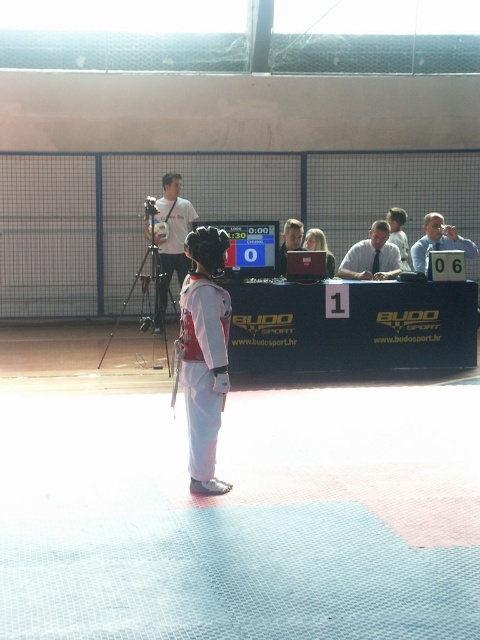
Who is positioned more to the left, light blue shirt at right or smooth brown hair at center?

smooth brown hair at center is more to the left.

Between light blue shirt at right and smooth brown hair at center, which one has more height?

light blue shirt at right

Which is behind, point (433, 248) or point (324, 243)?

Point (433, 248)

Locate an element on the screen. The height and width of the screenshot is (640, 480). light blue shirt at right is located at coordinates pos(439,241).

Is white matte karate robe at center further to camera compared to white shirt at center?

No, it is in front of white shirt at center.

Between point (204, 435) and point (400, 269), which one is positioned behind?

Positioned behind is point (400, 269).

Is point (212, 392) positioned behind point (363, 273)?

No, (212, 392) is closer to viewer.

Identify the location of white matte karate robe at center. (203, 365).

Does white matte karate robe at center have a smaller size compared to light blue shirt at right?

Yes.

Is white matte karate robe at center above light blue shirt at right?

Incorrect, white matte karate robe at center is not positioned above light blue shirt at right.

Who is more forward, (x=192, y=356) or (x=470, y=248)?

Point (x=192, y=356)

The image size is (480, 640). I want to click on white matte karate robe at center, so click(203, 365).